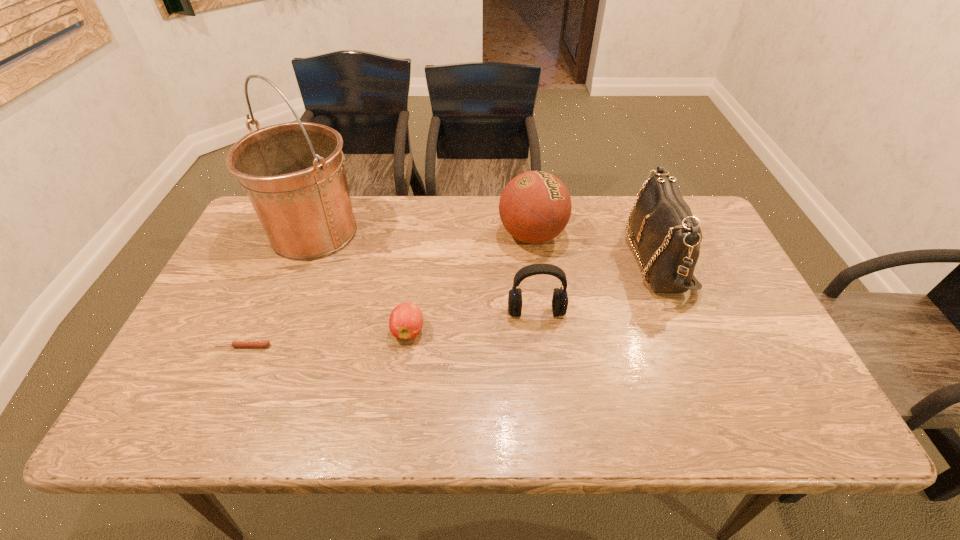
You are a GUI agent. You are given a task and a screenshot of the screen. Output one action in this format:
    pyautogui.click(x=<x>, y=<y>)
    Task: Click on the free space that satisfies the following two spatial constraints: 1. on the front side of the third object from left to right; 2. on the left side of the bucket
    This screenshot has width=960, height=540.
    Given the screenshot: What is the action you would take?
    pyautogui.click(x=276, y=330)

Locate an element on the screen. The height and width of the screenshot is (540, 960). vacant area that satisfies the following two spatial constraints: 1. on the back side of the basketball; 2. on the left side of the third object from left to right is located at coordinates (421, 235).